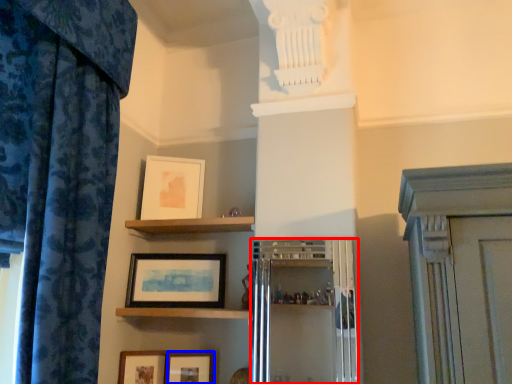
Question: Which object appears closest to the camera in this image, cabinetry (highlighted by a red box) or picture frame (highlighted by a blue box)?

Choices:
 (A) cabinetry
 (B) picture frame

Answer: (A)